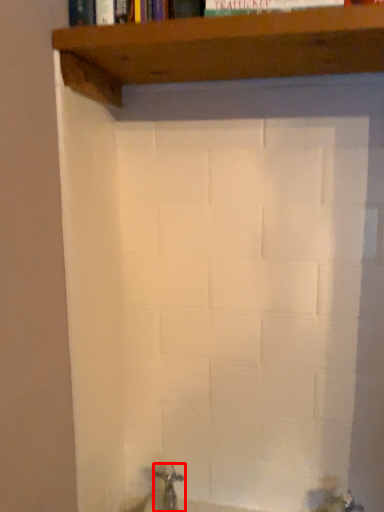
Question: From the image's perspective, where is tap (annotated by the red box) located in relation to shelf in the image?

Choices:
 (A) below
 (B) above

Answer: (A)